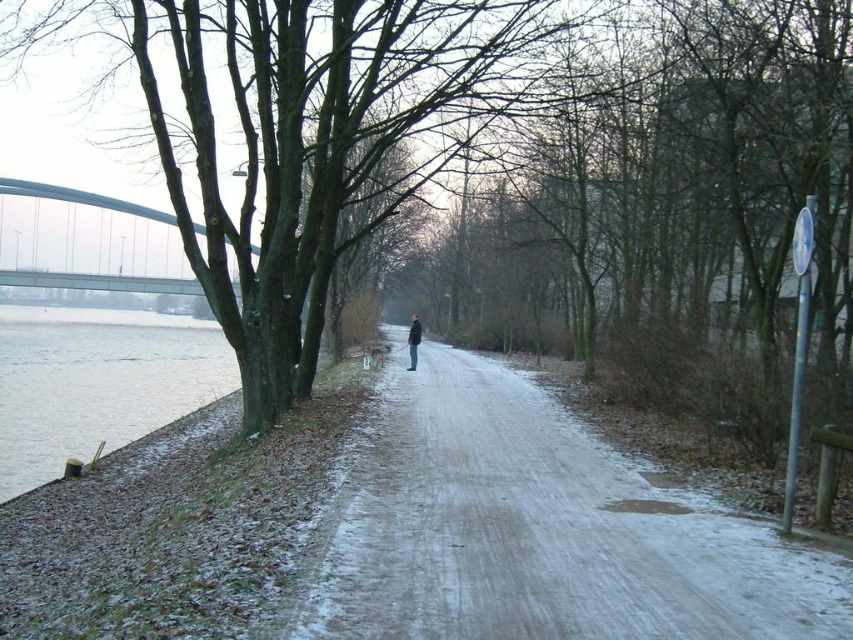
Can you confirm if gray concrete bridge at upper left is thinner than dark gray jacket at center?

Incorrect, gray concrete bridge at upper left's width is not less than dark gray jacket at center's.

Between point (32, 269) and point (415, 349), which one is positioned in front?

Point (415, 349) is in front.

Locate an element on the screen. The image size is (853, 640). gray concrete bridge at upper left is located at coordinates (97, 282).

Identify the location of sandy dirt road at center. (540, 531).

Find the location of `sandy dirt road at center`. sandy dirt road at center is located at coordinates (540, 531).

Locate an element on the screen. sandy dirt road at center is located at coordinates (540, 531).

Measure the distance between sandy dirt road at center and dark gray jacket at center.

sandy dirt road at center is 44.65 feet from dark gray jacket at center.

Find the location of a particular element. sandy dirt road at center is located at coordinates (540, 531).